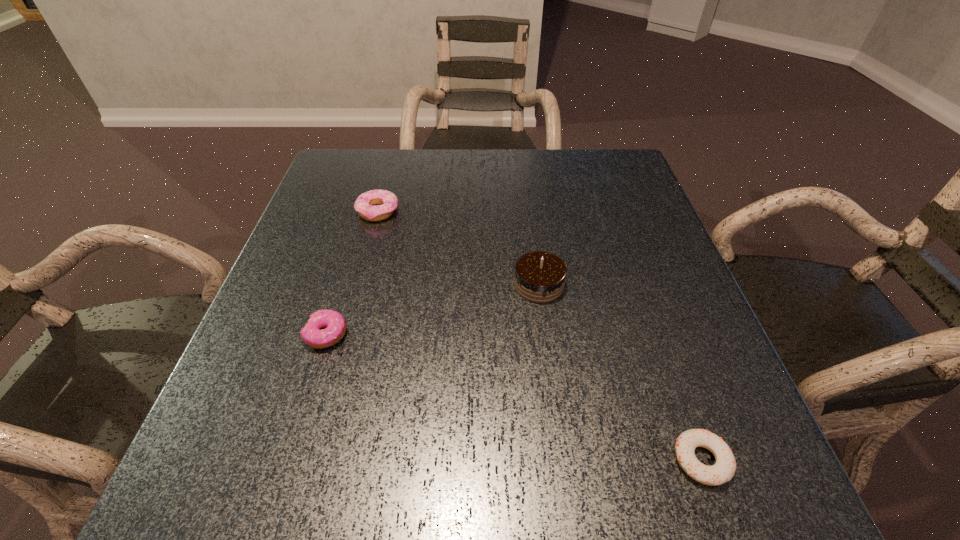
At what (x,y) coordinates should I click in order to perform the action: click on object identified as the closest to the rightmost doughnut. Please return your answer as a coordinate pair (x, y). This screenshot has height=540, width=960. Looking at the image, I should click on (540, 276).

This screenshot has height=540, width=960. Identify the location of object that stands as the closest to the rightmost doughnut. (540, 276).

Locate an element on the screen. doughnut that stands as the closest to the second nearest doughnut is located at coordinates (386, 202).

Where is `the third closest doughnut to the tallest object`? This screenshot has width=960, height=540. the third closest doughnut to the tallest object is located at coordinates (312, 335).

Image resolution: width=960 pixels, height=540 pixels. I want to click on vacant space that satisfies the following two spatial constraints: 1. on the front side of the chocolate cake; 2. on the left side of the shortest doughnut, so click(x=562, y=460).